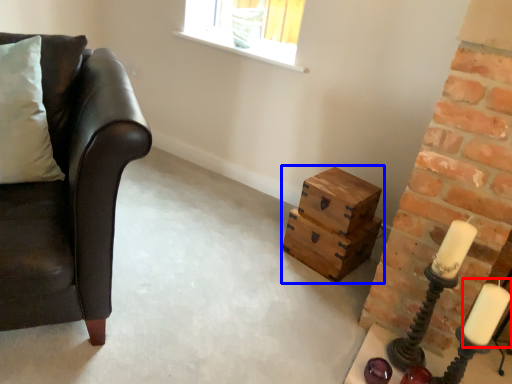
Question: Among these objects, which one is nearest to the camera, candle (highlighted by a red box) or crate (highlighted by a blue box)?

Choices:
 (A) candle
 (B) crate

Answer: (A)